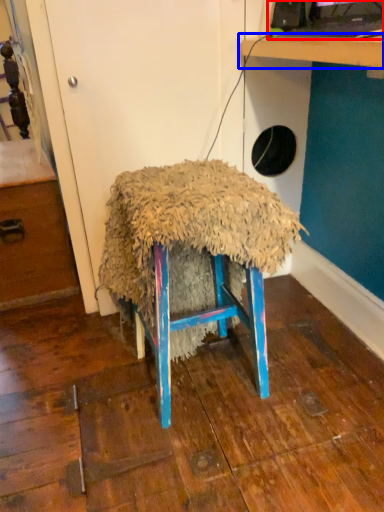
Question: Which object is closer to the camera taking this photo, desktop computer (highlighted by a red box) or table (highlighted by a blue box)?

Choices:
 (A) desktop computer
 (B) table

Answer: (B)